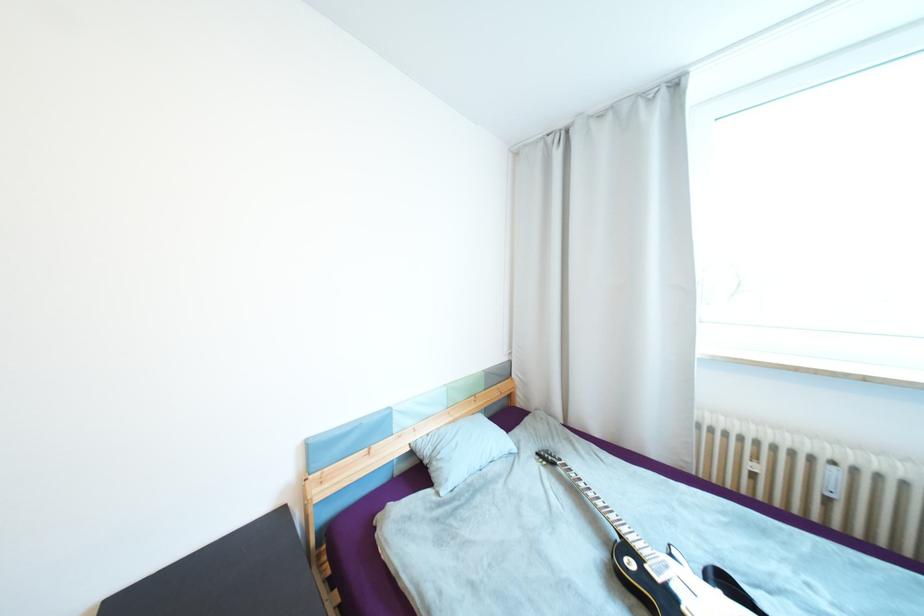
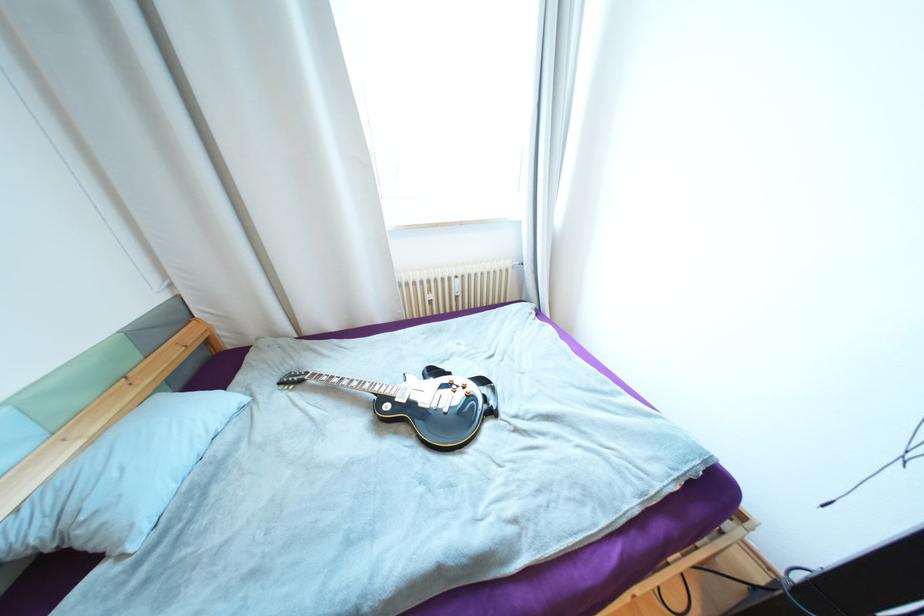
In the second image, find the point that corresponds to (833,500) in the first image.

(463, 297)